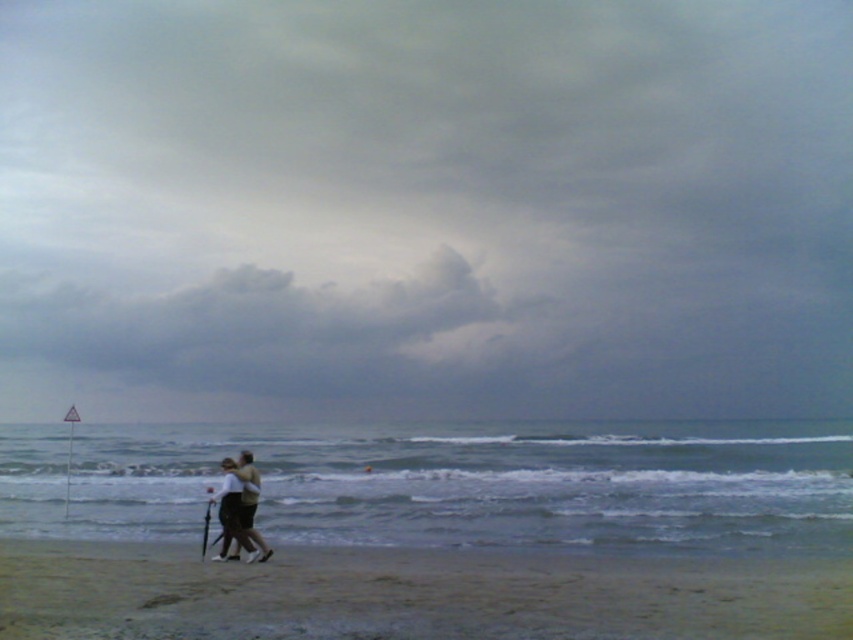
Question: Which of these objects is positioned closest to the gray cloudy sky at upper center?

Choices:
 (A) light brown fabric couple at center
 (B) sandy at lower center

Answer: (B)

Question: Can you confirm if sandy at lower center is bigger than light brown fabric couple at center?

Choices:
 (A) no
 (B) yes

Answer: (B)

Question: Based on their relative distances, which object is farther from the sandy at lower center?

Choices:
 (A) gray cloudy sky at upper center
 (B) light brown fabric couple at center

Answer: (A)

Question: In this image, where is sandy at lower center located relative to light brown fabric couple at center?

Choices:
 (A) left
 (B) right

Answer: (B)

Question: Among these points, which one is farthest from the camera?

Choices:
 (A) (254, 490)
 (B) (88, 211)
 (C) (103, 579)

Answer: (B)

Question: Considering the relative positions of gray cloudy sky at upper center and light brown fabric couple at center in the image provided, where is gray cloudy sky at upper center located with respect to light brown fabric couple at center?

Choices:
 (A) left
 (B) right

Answer: (B)